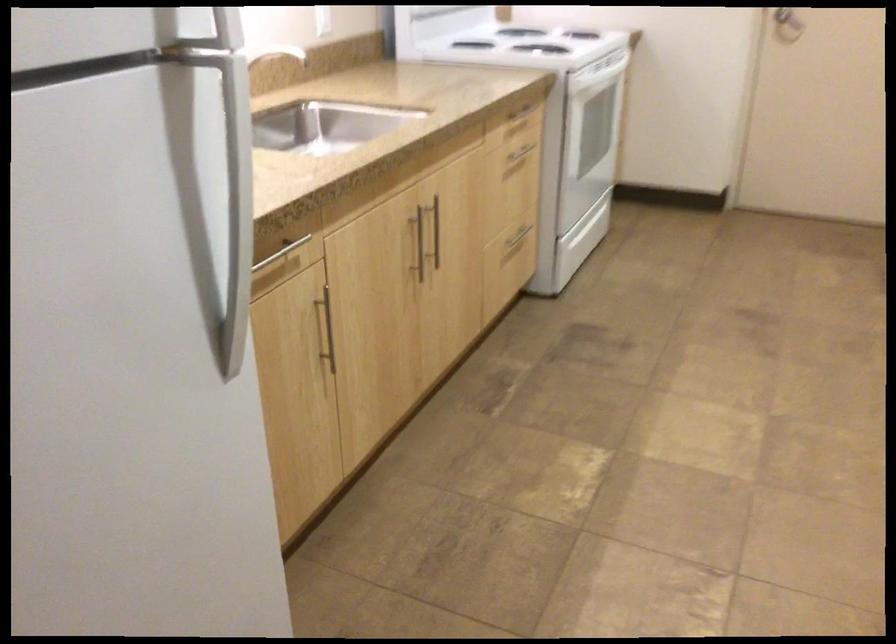
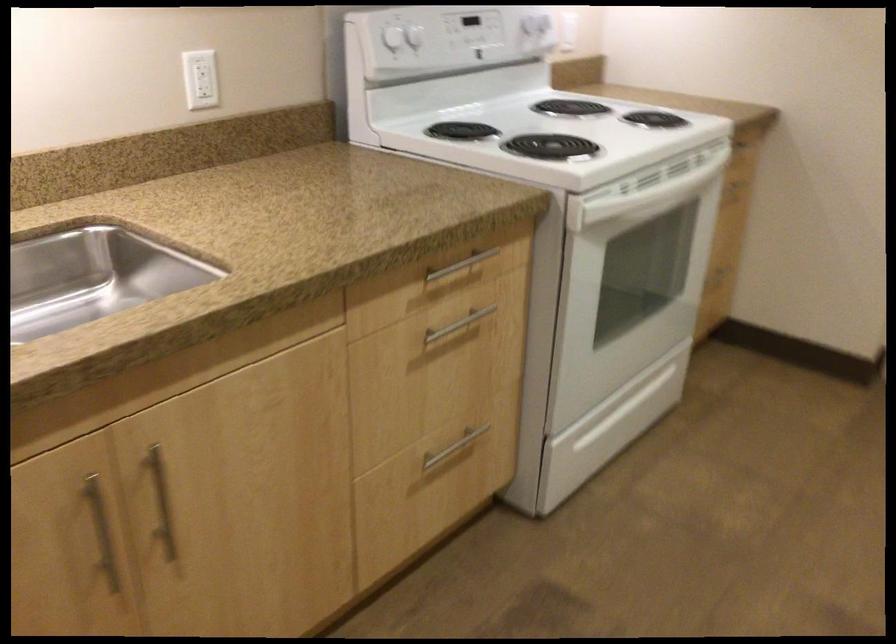
The point at (409, 251) is marked in the first image. Where is the corresponding point in the second image?

(101, 532)